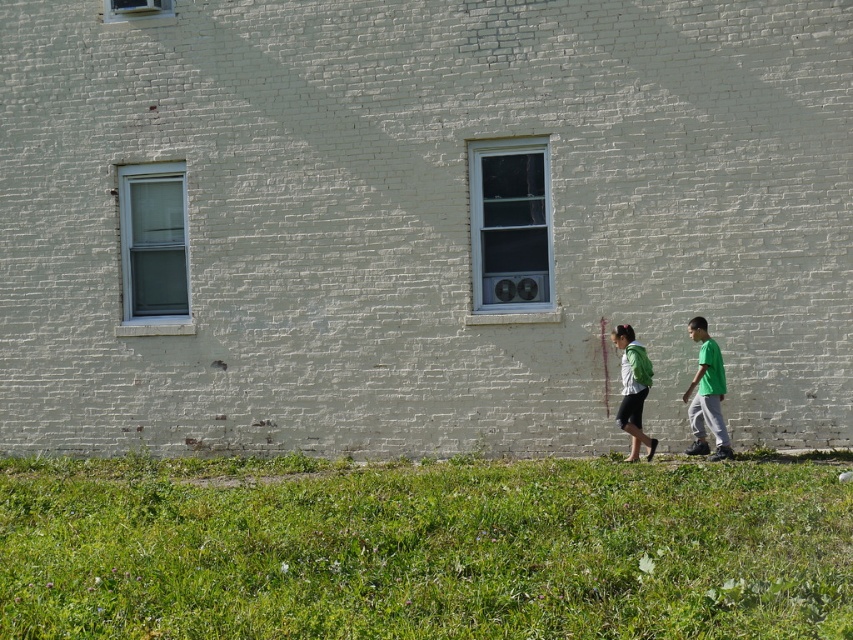
Question: Estimate the real-world distances between objects in this image. Which object is closer to the green matte shirt at right?

Choices:
 (A) green grass at lower center
 (B) green matte backpack at lower right

Answer: (B)

Question: Which of these objects is positioned closest to the green grass at lower center?

Choices:
 (A) green matte backpack at lower right
 (B) green matte shirt at right

Answer: (B)

Question: Which of the following is the closest to the observer?

Choices:
 (A) green matte backpack at lower right
 (B) green grass at lower center

Answer: (B)

Question: Does green matte shirt at right lie in front of green matte backpack at lower right?

Choices:
 (A) yes
 (B) no

Answer: (A)

Question: Can you confirm if green grass at lower center is positioned below green matte shirt at right?

Choices:
 (A) yes
 (B) no

Answer: (A)

Question: Is green matte shirt at right further to the viewer compared to green matte backpack at lower right?

Choices:
 (A) no
 (B) yes

Answer: (A)